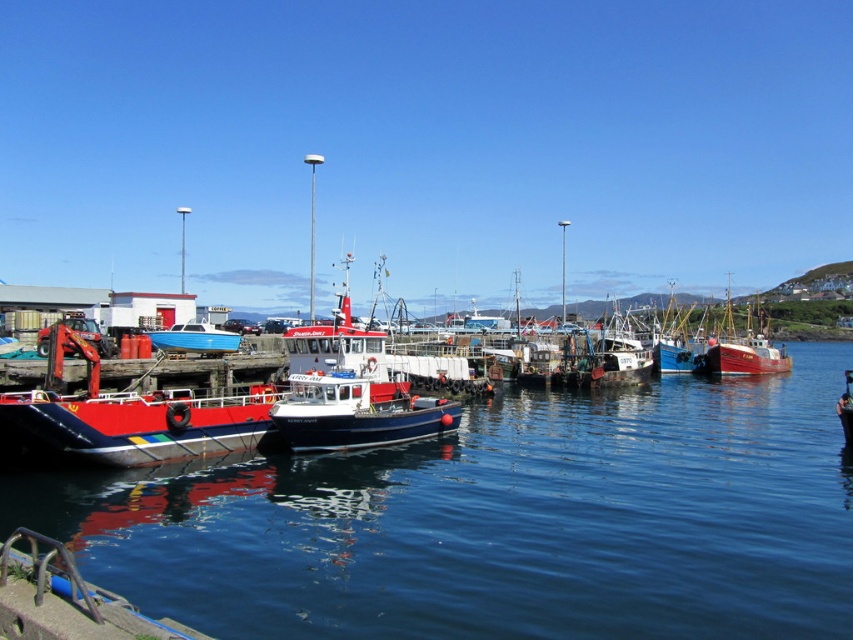
Which of these two, white glossy boat at center or red wooden boat at center, stands shorter?

With less height is white glossy boat at center.

Between point (627, 326) and point (755, 368), which one is positioned in front?

Point (755, 368)

Which is in front, point (648, 369) or point (762, 342)?

Positioned in front is point (648, 369).

The height and width of the screenshot is (640, 853). Identify the location of white glossy boat at center. (619, 355).

Between point (601, 356) and point (674, 332), which one is positioned behind?

The point (674, 332) is more distant.

Does white glossy boat at center have a larger size compared to blue wooden boat at center?

Actually, white glossy boat at center might be smaller than blue wooden boat at center.

Find the location of a particular element. white glossy boat at center is located at coordinates (619, 355).

Which is in front, point (610, 321) or point (180, 339)?

Point (180, 339) is in front.

Can you confirm if white glossy boat at center is positioned to the left of red matte boat at left?

Incorrect, white glossy boat at center is not on the left side of red matte boat at left.

Which is in front, point (612, 349) or point (184, 346)?

Point (184, 346) is more forward.

You are a GUI agent. You are given a task and a screenshot of the screen. Output one action in this format:
    pyautogui.click(x=<x>, y=<y>)
    Task: Click on the white glossy boat at center
    
    Given the screenshot: What is the action you would take?
    (619, 355)